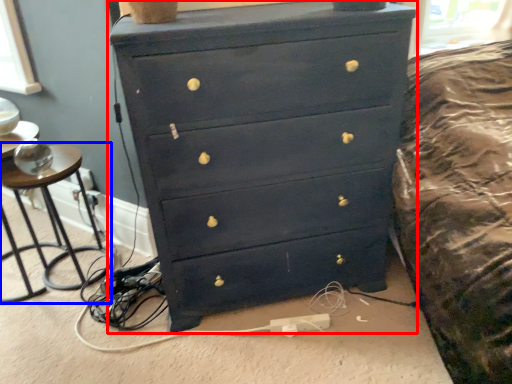
Question: Which point is closer to the camera, chest of drawers (highlighted by a red box) or side table (highlighted by a blue box)?

Choices:
 (A) chest of drawers
 (B) side table

Answer: (A)